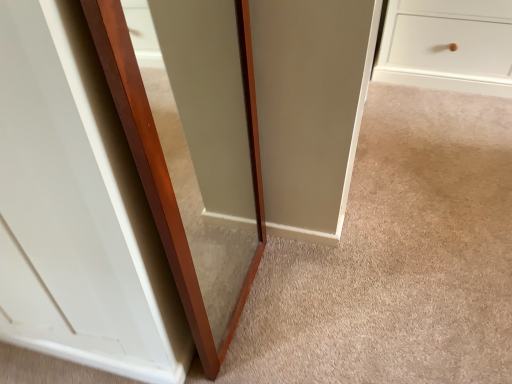
What is the approximate height of transparent glass door at center, the first glass door viewed from the right?

It is 3.33 feet.

From the picture: Measure the distance between point (x=90, y=16) and camera.

Point (x=90, y=16) is 19.88 inches from camera.

Find the location of a particular element. transparent glass door at center, which is the second glass door from left to right is located at coordinates (166, 165).

What do you see at coordinates (166, 165) in the screenshot?
I see `transparent glass door at center, the first glass door viewed from the right` at bounding box center [166, 165].

Locate an element on the screen. The width and height of the screenshot is (512, 384). transparent glass door at center, placed as the second glass door when sorted from right to left is located at coordinates (77, 209).

The image size is (512, 384). Describe the element at coordinates (77, 209) in the screenshot. I see `transparent glass door at center, the 1th glass door positioned from the left` at that location.

This screenshot has width=512, height=384. Identify the location of transparent glass door at center, the first glass door viewed from the right. (166, 165).

Does transparent glass door at center, the first glass door viewed from the right, appear on the right side of transparent glass door at center, placed as the second glass door when sorted from right to left?

Yes, transparent glass door at center, the first glass door viewed from the right, is to the right of transparent glass door at center, placed as the second glass door when sorted from right to left.

In the scene shown: Who is more distant, transparent glass door at center, which is the second glass door from left to right, or transparent glass door at center, placed as the second glass door when sorted from right to left?

transparent glass door at center, which is the second glass door from left to right, is more distant.

In the scene shown: Which point is more distant from viewer, (124, 84) or (37, 151)?

The point (37, 151) is farther.

From the image's perspective, who appears lower, transparent glass door at center, which is the second glass door from left to right, or transparent glass door at center, placed as the second glass door when sorted from right to left?

transparent glass door at center, which is the second glass door from left to right, from the image's perspective.

From a real-world perspective, is transparent glass door at center, which is the second glass door from left to right, positioned above or below transparent glass door at center, placed as the second glass door when sorted from right to left?

From a real-world perspective, transparent glass door at center, which is the second glass door from left to right, is physically below transparent glass door at center, placed as the second glass door when sorted from right to left.

In terms of width, does transparent glass door at center, which is the second glass door from left to right, look wider or thinner when compared to transparent glass door at center, the 1th glass door positioned from the left?

transparent glass door at center, which is the second glass door from left to right, is thinner than transparent glass door at center, the 1th glass door positioned from the left.

Which of these two, transparent glass door at center, which is the second glass door from left to right, or transparent glass door at center, the 1th glass door positioned from the left, stands shorter?

transparent glass door at center, which is the second glass door from left to right, is shorter.

Consider the image. Considering the sizes of transparent glass door at center, the first glass door viewed from the right, and transparent glass door at center, the 1th glass door positioned from the left, in the image, is transparent glass door at center, the first glass door viewed from the right, bigger or smaller than transparent glass door at center, the 1th glass door positioned from the left,?

transparent glass door at center, the first glass door viewed from the right, is smaller than transparent glass door at center, the 1th glass door positioned from the left.

Which is correct: transparent glass door at center, the first glass door viewed from the right, is inside transparent glass door at center, placed as the second glass door when sorted from right to left, or outside of it?

transparent glass door at center, the first glass door viewed from the right, lies outside transparent glass door at center, placed as the second glass door when sorted from right to left.

Is transparent glass door at center, the first glass door viewed from the right, not near transparent glass door at center, placed as the second glass door when sorted from right to left?

They are positioned close to each other.

Is transparent glass door at center, which is the second glass door from left to right, turned away from transparent glass door at center, the 1th glass door positioned from the left?

Yes, transparent glass door at center, which is the second glass door from left to right, is positioned with its back facing transparent glass door at center, the 1th glass door positioned from the left.

Measure the distance between transparent glass door at center, which is the second glass door from left to right, and transparent glass door at center, the 1th glass door positioned from the left.

A distance of 16.38 centimeters exists between transparent glass door at center, which is the second glass door from left to right, and transparent glass door at center, the 1th glass door positioned from the left.

What are the coordinates of `glass door located above the transparent glass door at center, the first glass door viewed from the right (from a real-world perspective)` in the screenshot? It's located at (77, 209).

Which is more to the right, transparent glass door at center, the 1th glass door positioned from the left, or transparent glass door at center, the first glass door viewed from the right?

Positioned to the right is transparent glass door at center, the first glass door viewed from the right.

Which object is closer to the camera taking this photo, transparent glass door at center, placed as the second glass door when sorted from right to left, or transparent glass door at center, the first glass door viewed from the right?

transparent glass door at center, placed as the second glass door when sorted from right to left, is closer to the camera.

Is point (63, 113) in front of point (162, 191)?

Yes, point (63, 113) is closer to viewer.

From the image's perspective, is transparent glass door at center, the 1th glass door positioned from the left, positioned above or below transparent glass door at center, which is the second glass door from left to right?

transparent glass door at center, the 1th glass door positioned from the left, is situated higher than transparent glass door at center, which is the second glass door from left to right, in the image.

From a real-world perspective, who is located lower, transparent glass door at center, placed as the second glass door when sorted from right to left, or transparent glass door at center, the first glass door viewed from the right?

transparent glass door at center, the first glass door viewed from the right.

Considering the relative sizes of transparent glass door at center, placed as the second glass door when sorted from right to left, and transparent glass door at center, which is the second glass door from left to right, in the image provided, is transparent glass door at center, placed as the second glass door when sorted from right to left, wider than transparent glass door at center, which is the second glass door from left to right,?

Yes.

Consider the image. Is transparent glass door at center, the 1th glass door positioned from the left, shorter than transparent glass door at center, the first glass door viewed from the right?

No, transparent glass door at center, the 1th glass door positioned from the left, is not shorter than transparent glass door at center, the first glass door viewed from the right.

Considering the sizes of transparent glass door at center, the 1th glass door positioned from the left, and transparent glass door at center, which is the second glass door from left to right, in the image, is transparent glass door at center, the 1th glass door positioned from the left, bigger or smaller than transparent glass door at center, which is the second glass door from left to right,?

In the image, transparent glass door at center, the 1th glass door positioned from the left, appears to be larger than transparent glass door at center, which is the second glass door from left to right.

In the scene shown: Which is correct: transparent glass door at center, the 1th glass door positioned from the left, is inside transparent glass door at center, which is the second glass door from left to right, or outside of it?

transparent glass door at center, the 1th glass door positioned from the left, is not inside transparent glass door at center, which is the second glass door from left to right, it's outside.

Is transparent glass door at center, placed as the second glass door when sorted from right to left, touching transparent glass door at center, which is the second glass door from left to right?

There is a gap between transparent glass door at center, placed as the second glass door when sorted from right to left, and transparent glass door at center, which is the second glass door from left to right.

Is transparent glass door at center, the 1th glass door positioned from the left, looking in the opposite direction of transparent glass door at center, which is the second glass door from left to right?

transparent glass door at center, the 1th glass door positioned from the left, does not have its back to transparent glass door at center, which is the second glass door from left to right.

Locate an element on the screen. glass door that appears on the right of transparent glass door at center, placed as the second glass door when sorted from right to left is located at coordinates (166, 165).

Identify the location of glass door on the left of the transparent glass door at center, which is the second glass door from left to right. (77, 209).

You are a GUI agent. You are given a task and a screenshot of the screen. Output one action in this format:
    pyautogui.click(x=<x>, y=<y>)
    Task: Click on the glass door in front of the transparent glass door at center, which is the second glass door from left to right
    This screenshot has width=512, height=384.
    Given the screenshot: What is the action you would take?
    pyautogui.click(x=77, y=209)